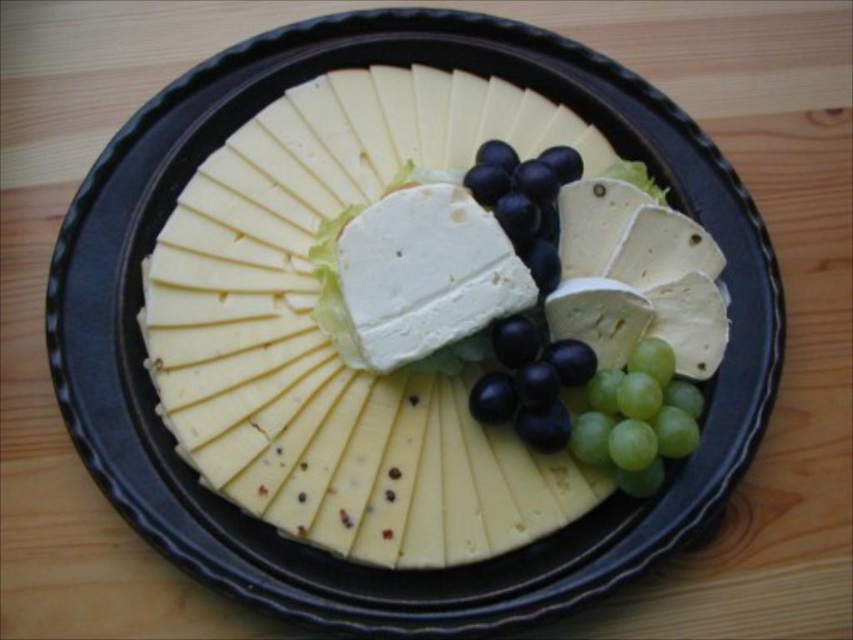
Does green matte grapes at lower right appear on the left side of purple glossy grapes at center?

Incorrect, green matte grapes at lower right is not on the left side of purple glossy grapes at center.

Who is more forward, (664, 412) or (537, 284)?

Point (664, 412) is in front.

Is point (635, 438) positioned before point (544, 168)?

Yes, point (635, 438) is closer to viewer.

Find the location of a particular element. The height and width of the screenshot is (640, 853). green matte grapes at lower right is located at coordinates (637, 419).

Measure the distance between point (660, 442) and camera.

They are 1.28 meters apart.

Which is behind, point (635, 396) or point (523, 381)?

Positioned behind is point (523, 381).

Locate an element on the screen. green matte grapes at lower right is located at coordinates (637, 419).

From the picture: Measure the distance from black glossy grapes at center to purple glossy grapes at center.

black glossy grapes at center and purple glossy grapes at center are 6.74 inches apart.

Is black glossy grapes at center positioned at the back of purple glossy grapes at center?

No, black glossy grapes at center is in front of purple glossy grapes at center.

Who is more distant from viewer, (515, 333) or (540, 256)?

The point (540, 256) is behind.

Locate an element on the screen. This screenshot has width=853, height=640. black glossy grapes at center is located at coordinates (531, 381).